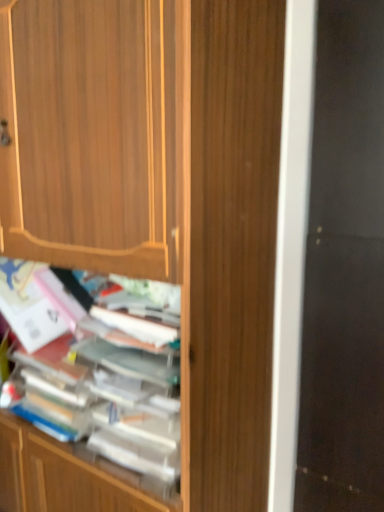
The height and width of the screenshot is (512, 384). What do you see at coordinates (344, 269) in the screenshot? I see `black glass screen door at right` at bounding box center [344, 269].

Find the location of a particular element. The width and height of the screenshot is (384, 512). wooden books at center is located at coordinates (89, 432).

The width and height of the screenshot is (384, 512). I want to click on black glass screen door at right, so click(x=344, y=269).

From the picture: Is black glass screen door at right inside the boundaries of wooden cabinet at center, or outside?

black glass screen door at right cannot be found inside wooden cabinet at center.

Considering the relative sizes of black glass screen door at right and wooden cabinet at center in the image provided, is black glass screen door at right wider than wooden cabinet at center?

Yes.

Considering their positions, is black glass screen door at right located in front of or behind wooden cabinet at center?

Clearly, black glass screen door at right is behind wooden cabinet at center.

Is black glass screen door at right at the back of wooden cabinet at center?

That's right, wooden cabinet at center is facing away from black glass screen door at right.

Between point (30, 123) and point (358, 219), which one is positioned behind?

The point (358, 219) is farther from the camera.

Is wooden cabinet at center completely or partially outside of black glass screen door at right?

Absolutely, wooden cabinet at center is external to black glass screen door at right.

Which object is positioned more to the left, wooden cabinet at center or black glass screen door at right?

wooden cabinet at center is more to the left.

Considering the positions of objects wooden books at center and black glass screen door at right in the image provided, who is in front, wooden books at center or black glass screen door at right?

wooden books at center is in front.

Does wooden books at center have a lesser height compared to black glass screen door at right?

Correct, wooden books at center is not as tall as black glass screen door at right.

Which is more to the right, wooden books at center or black glass screen door at right?

black glass screen door at right is more to the right.

Based on the photo, which of these two, black glass screen door at right or wooden books at center, is bigger?

black glass screen door at right.

Looking at this image, from a real-world perspective, is black glass screen door at right beneath wooden books at center?

No, from a real-world perspective, black glass screen door at right is not beneath wooden books at center.

Looking at this image, would you say black glass screen door at right is to the left or to the right of wooden books at center in the picture?

Based on their positions, black glass screen door at right is located to the right of wooden books at center.

From the image's perspective, which is above, black glass screen door at right or wooden books at center?

From the image's view, black glass screen door at right is above.

Considering the relative sizes of wooden cabinet at center and wooden books at center in the image provided, is wooden cabinet at center shorter than wooden books at center?

Incorrect, the height of wooden cabinet at center does not fall short of that of wooden books at center.

Where is `shelf on the right of wooden cabinet at center`? shelf on the right of wooden cabinet at center is located at coordinates (89, 432).

From the image's perspective, which is above, wooden cabinet at center or wooden books at center?

From the image's view, wooden books at center is above.

Can you tell me how much wooden cabinet at center and wooden books at center differ in facing direction?

0.901 degrees separate the facing orientations of wooden cabinet at center and wooden books at center.

From their relative heights in the image, would you say wooden books at center is taller or shorter than wooden cabinet at center?

In the image, wooden books at center appears to be shorter than wooden cabinet at center.

Is wooden books at center aimed at wooden cabinet at center?

Yes, wooden books at center is facing wooden cabinet at center.

Considering the sizes of wooden books at center and wooden cabinet at center in the image, is wooden books at center wider or thinner than wooden cabinet at center?

Considering their sizes, wooden books at center looks slimmer than wooden cabinet at center.

From the image's perspective, which is above, wooden books at center or wooden cabinet at center?

wooden books at center.

This screenshot has height=512, width=384. In order to click on cabinetry below the black glass screen door at right (from the image's perspective) in this screenshot , I will do `click(160, 190)`.

I want to click on screen door located above the wooden cabinet at center (from the image's perspective), so click(344, 269).

When comparing their distances from black glass screen door at right, does wooden cabinet at center or wooden books at center seem closer?

The object closer to black glass screen door at right is wooden cabinet at center.

Which object lies nearer to the anchor point wooden cabinet at center, black glass screen door at right or wooden books at center?

wooden books at center is closer to wooden cabinet at center.

Looking at the image, which one is located closer to wooden books at center, black glass screen door at right or wooden cabinet at center?

wooden cabinet at center is closer to wooden books at center.

Which object lies nearer to the anchor point wooden cabinet at center, wooden books at center or black glass screen door at right?

wooden books at center.

From the image, which object appears to be farther from wooden books at center, wooden cabinet at center or black glass screen door at right?

black glass screen door at right lies further to wooden books at center than the other object.

Looking at the image, which one is located closer to black glass screen door at right, wooden books at center or wooden cabinet at center?

Result: Based on the image, wooden cabinet at center appears to be nearer to black glass screen door at right.

I want to click on shelf located between wooden cabinet at center and black glass screen door at right in the left-right direction, so click(89, 432).